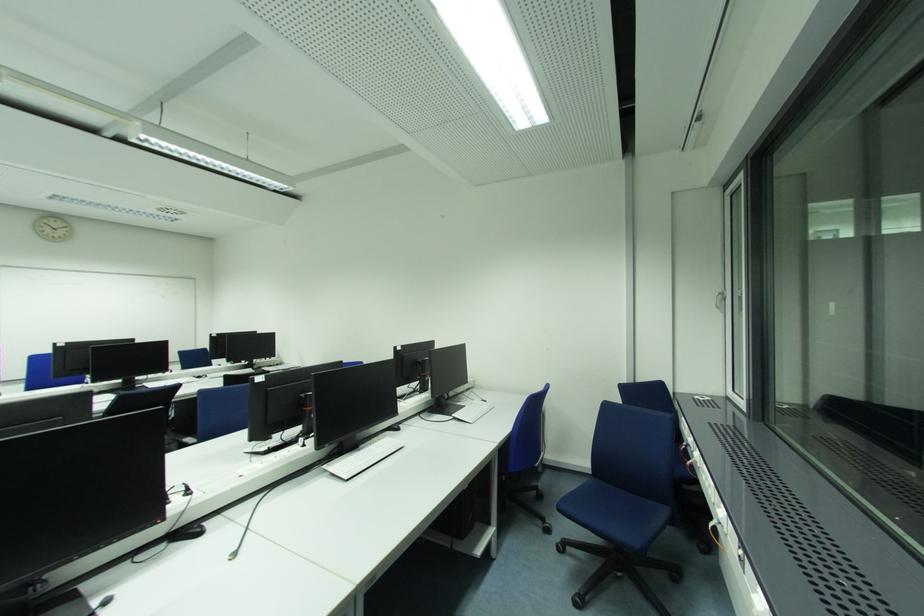
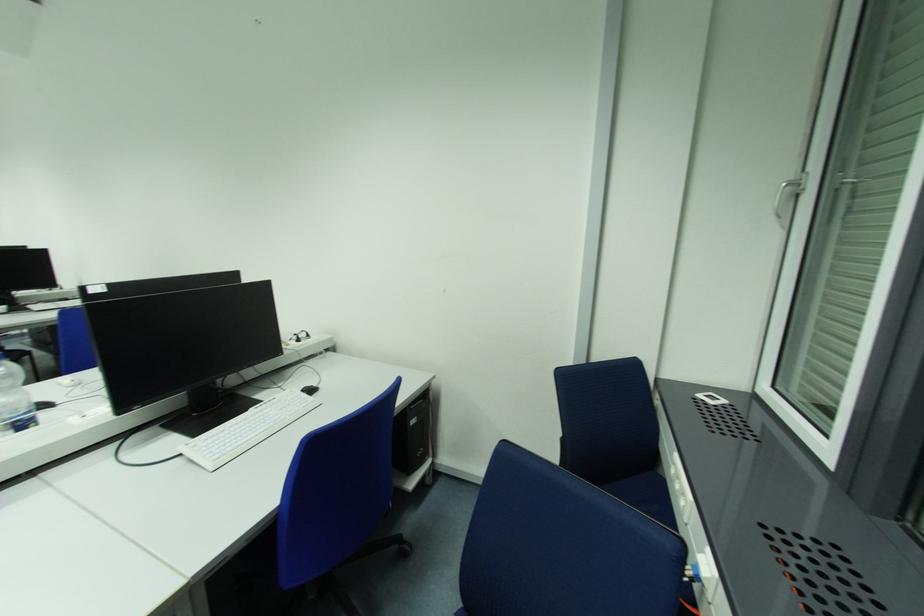
The point at (487, 403) is marked in the first image. Where is the corresponding point in the second image?

(312, 392)